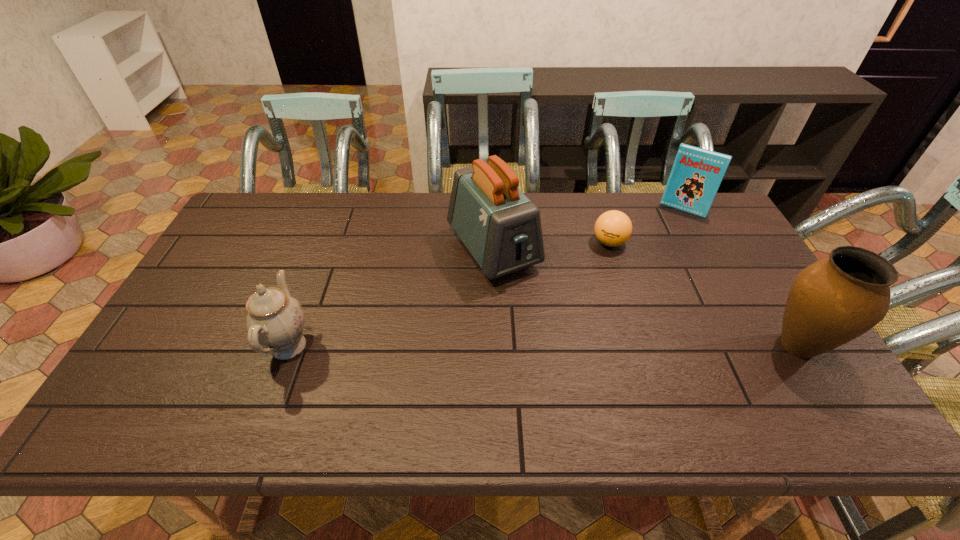
Where is `toaster present at the far edge`? The width and height of the screenshot is (960, 540). toaster present at the far edge is located at coordinates (x=499, y=225).

In order to click on book that is at the far edge in this screenshot , I will do `click(697, 173)`.

Where is `chinaware at the near edge`? This screenshot has height=540, width=960. chinaware at the near edge is located at coordinates (274, 319).

Where is `urn that is at the near edge`? This screenshot has height=540, width=960. urn that is at the near edge is located at coordinates (831, 302).

The image size is (960, 540). I want to click on urn present at the right edge, so click(831, 302).

Where is `book located at the right edge`? The image size is (960, 540). book located at the right edge is located at coordinates (697, 173).

The image size is (960, 540). I want to click on object present at the far right corner, so click(x=697, y=173).

Find the location of a particular element. object situated at the near right corner is located at coordinates (831, 302).

The image size is (960, 540). In order to click on vacant point at the far edge in this screenshot , I will do `click(320, 192)`.

In order to click on blank area at the near edge in this screenshot , I will do `click(416, 384)`.